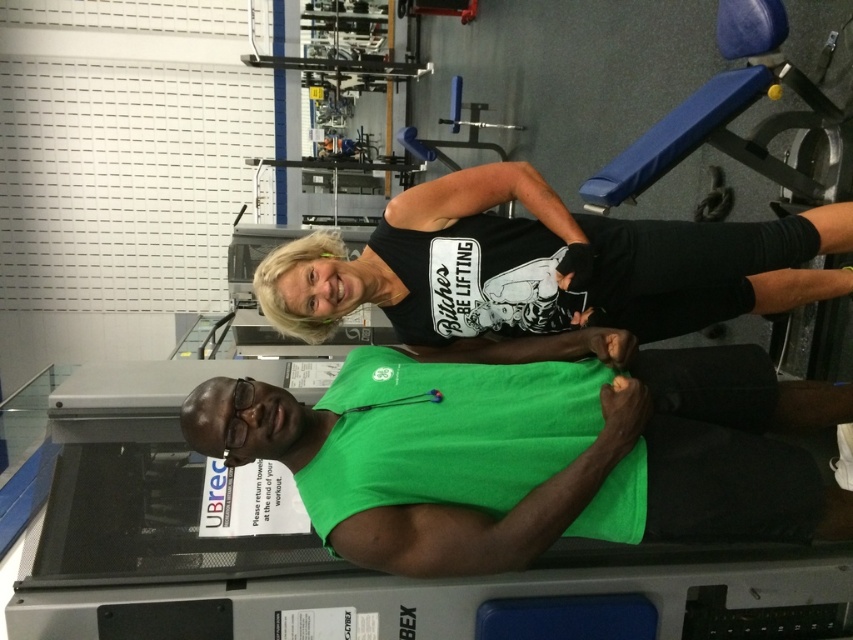
You are a fitness trainer standing 1.5 meters away from the camera. You need to adjust the green fabric squat at center. Can you reach it without moving closer?

The green fabric squat at center is 1.38 meters away from the camera. Since you are 1.5 meters away from the camera, you are farther than the equipment. You would need to move closer to reach it.

In the gym scene, there are two points marked as point 1 at coordinates (363, 557) and point 2 at (850, 291). From the perspective of someone standing at the front of the gym, which point is closer to the entrance?

Point 1 at coordinates (363, 557) is closer to the entrance because it is in front of point 2 at (850, 291).

You are a photographer setting up a shoot in a gym. You need to position a camera so that both the green fabric squat at center and the black matte tank top at upper center are visible without obstruction. Based on their positions, which object should be closer to the camera?

The green fabric squat at center is in front of the black matte tank top at upper center, so the green fabric squat at center should be closer to the camera to ensure both are visible without obstruction.